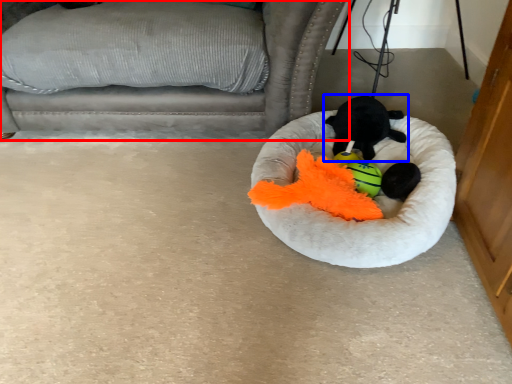
Question: Which of the following is the closest to the observer, furniture (highlighted by a red box) or toy (highlighted by a blue box)?

Choices:
 (A) furniture
 (B) toy

Answer: (A)